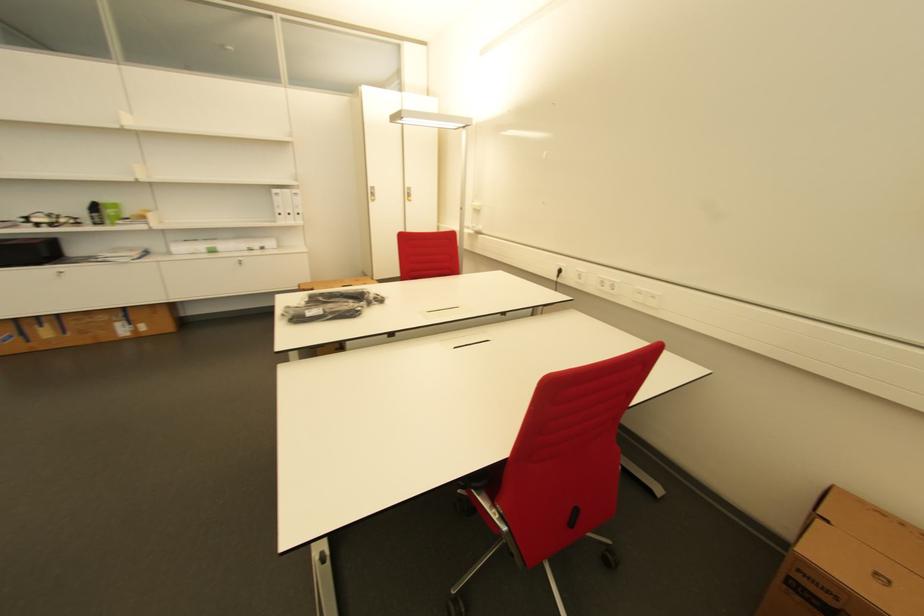
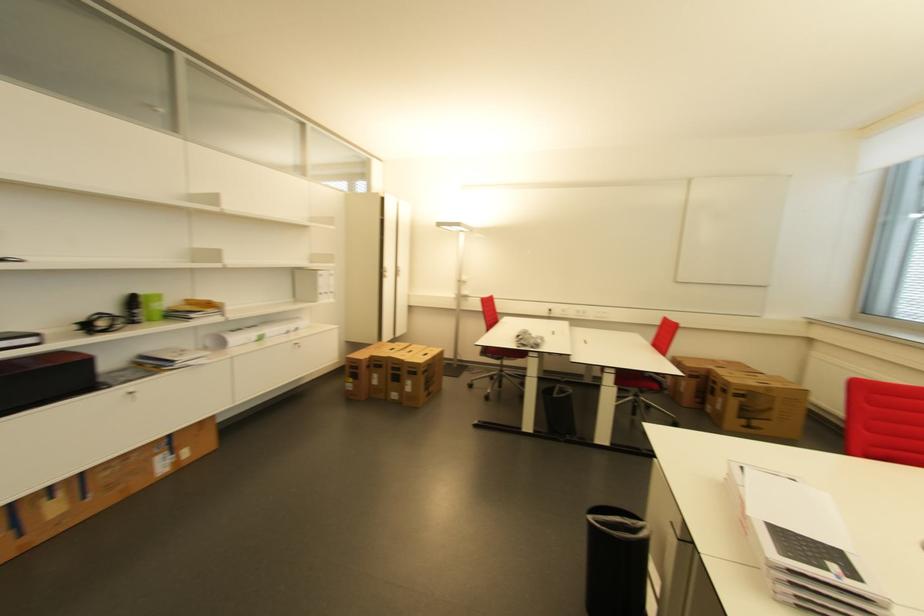
Where in the second image is the point corresponding to [246,262] from the first image?

(300, 345)